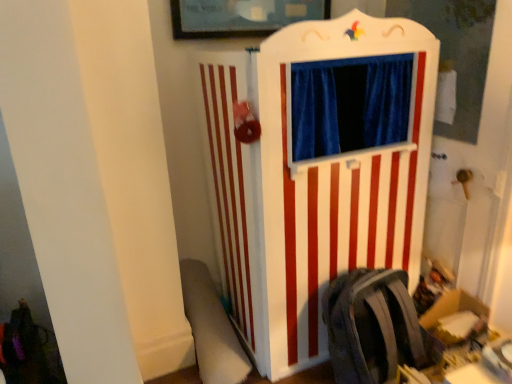
Question: Is white plush swivel chair at lower left taller than white wood puppet theater at center?

Choices:
 (A) no
 (B) yes

Answer: (A)

Question: Is white plush swivel chair at lower left shorter than white wood puppet theater at center?

Choices:
 (A) yes
 (B) no

Answer: (A)

Question: Would you say white wood puppet theater at center is part of white plush swivel chair at lower left's contents?

Choices:
 (A) yes
 (B) no

Answer: (B)

Question: Does white plush swivel chair at lower left come behind white wood puppet theater at center?

Choices:
 (A) yes
 (B) no

Answer: (A)

Question: Considering the relative sizes of white plush swivel chair at lower left and white wood puppet theater at center in the image provided, is white plush swivel chair at lower left wider than white wood puppet theater at center?

Choices:
 (A) yes
 (B) no

Answer: (B)

Question: From a real-world perspective, is white wood puppet theater at center positioned above or below matte gray backpack at lower right?

Choices:
 (A) below
 (B) above

Answer: (B)

Question: Is white wood puppet theater at center bigger or smaller than matte gray backpack at lower right?

Choices:
 (A) big
 (B) small

Answer: (A)

Question: From the image's perspective, relative to matte gray backpack at lower right, is white wood puppet theater at center above or below?

Choices:
 (A) below
 (B) above

Answer: (B)

Question: Considering the relative positions of white wood puppet theater at center and matte gray backpack at lower right in the image provided, is white wood puppet theater at center to the left or to the right of matte gray backpack at lower right?

Choices:
 (A) left
 (B) right

Answer: (A)

Question: From a real-world perspective, relative to white plush swivel chair at lower left, is matte gray backpack at lower right vertically above or below?

Choices:
 (A) below
 (B) above

Answer: (B)

Question: Considering the positions of matte gray backpack at lower right and white plush swivel chair at lower left in the image, is matte gray backpack at lower right wider or thinner than white plush swivel chair at lower left?

Choices:
 (A) thin
 (B) wide

Answer: (A)

Question: Considering the positions of point (375, 297) and point (217, 311), is point (375, 297) closer or farther from the camera than point (217, 311)?

Choices:
 (A) closer
 (B) farther

Answer: (A)

Question: Is matte gray backpack at lower right in front of or behind white plush swivel chair at lower left in the image?

Choices:
 (A) behind
 (B) front

Answer: (B)

Question: Looking at their shapes, would you say white wood puppet theater at center is wider or thinner than white plush swivel chair at lower left?

Choices:
 (A) wide
 (B) thin

Answer: (A)

Question: Considering the relative positions of white wood puppet theater at center and white plush swivel chair at lower left in the image provided, is white wood puppet theater at center to the left or to the right of white plush swivel chair at lower left?

Choices:
 (A) left
 (B) right

Answer: (B)